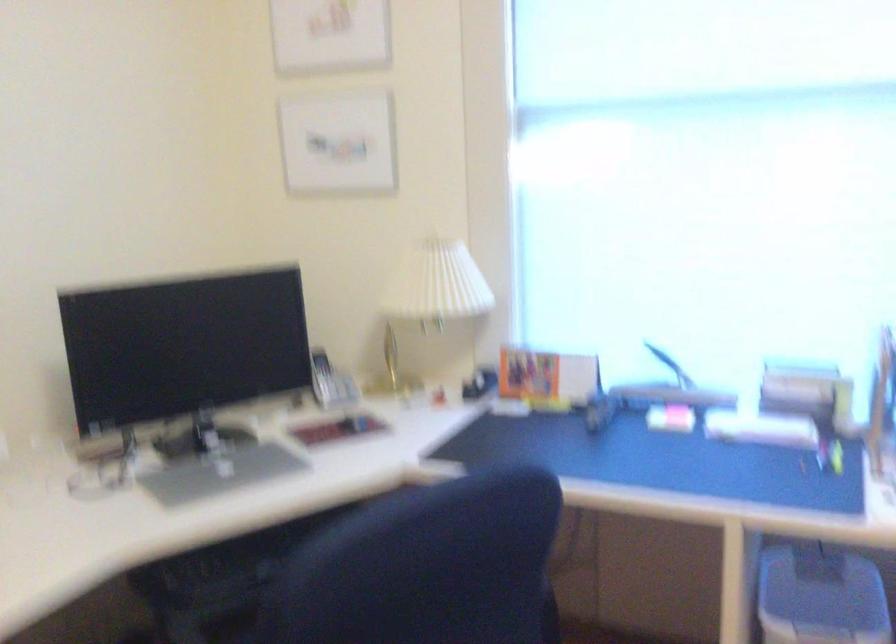
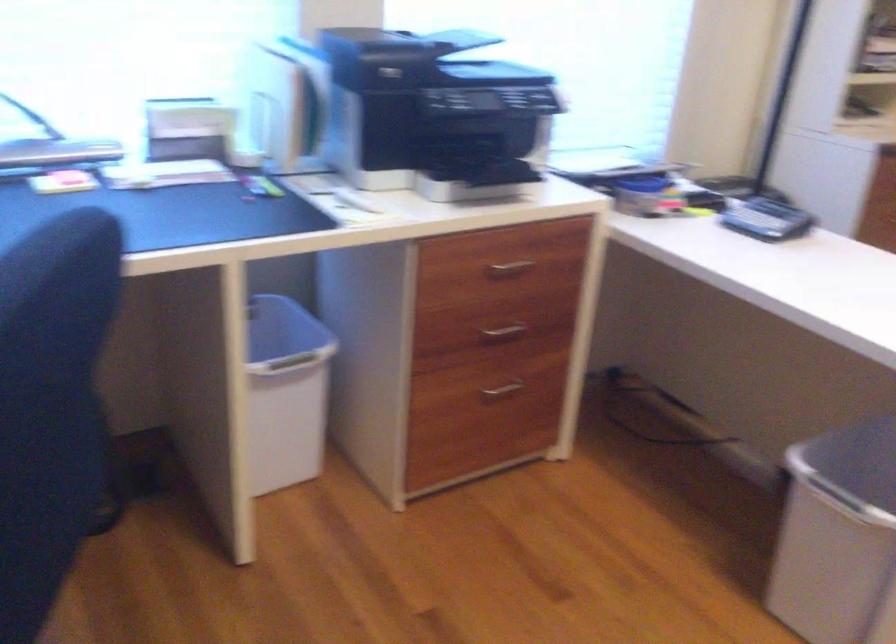
Question: I am providing you with two images of the same scene from different viewpoints. Please identify which objects are invisible in image2.

Choices:
 (A) silver drawer handle
 (B) grey calculator
 (C) orange plastic pitcher
 (D) small grey bin

Answer: (D)